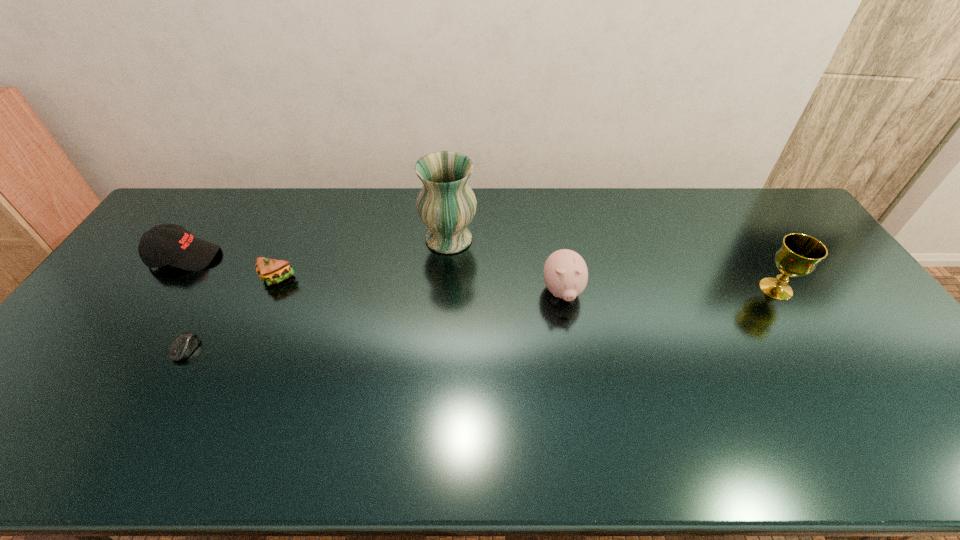
The image size is (960, 540). What are the coordinates of `free region at the near edge` in the screenshot? It's located at (631, 456).

Where is `vacant space at the left edge`? The height and width of the screenshot is (540, 960). vacant space at the left edge is located at coordinates (71, 404).

In the image, there is a desktop. At what (x,y) coordinates should I click in order to perform the action: click on free region at the right edge. Please return your answer as a coordinate pair (x, y). The height and width of the screenshot is (540, 960). Looking at the image, I should click on (866, 386).

I want to click on vacant area at the far left corner of the desktop, so click(x=200, y=197).

At what (x,y) coordinates should I click in order to perform the action: click on free space between the tallest object and the mouse. Please return your answer as a coordinate pair (x, y). Looking at the image, I should click on pos(318,294).

Locate an element on the screen. vacant area between the piggy bank and the vase is located at coordinates (506, 266).

The width and height of the screenshot is (960, 540). Find the location of `free spot between the baseball cap and the third object from right to left`. free spot between the baseball cap and the third object from right to left is located at coordinates (317, 248).

Find the location of `free area in between the fourth object from left to right and the piggy bank`. free area in between the fourth object from left to right and the piggy bank is located at coordinates (506, 266).

The height and width of the screenshot is (540, 960). I want to click on empty location between the shortest object and the tallest object, so click(x=318, y=294).

In order to click on free space between the fifth object from left to right and the mouse in this screenshot , I will do (x=374, y=321).